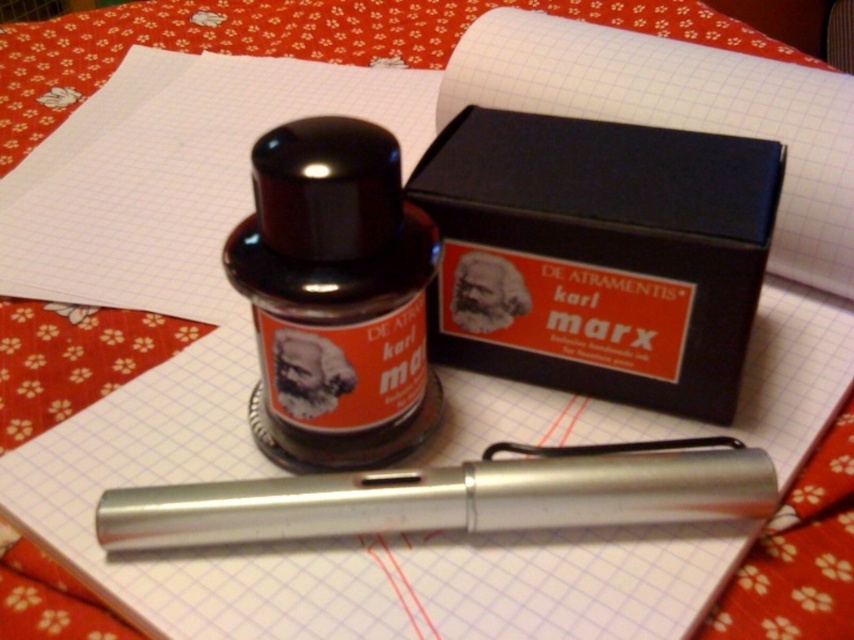
In the scene shown: You are an artist trying to sketch this still life. You need to determine which of the two points, point [325,218] or point [109,544], is closer to you. Based on the scene description, which point should you focus on first?

Point [325,218] is closer to the viewer than point [109,544], so you should focus on point [325,218] first.